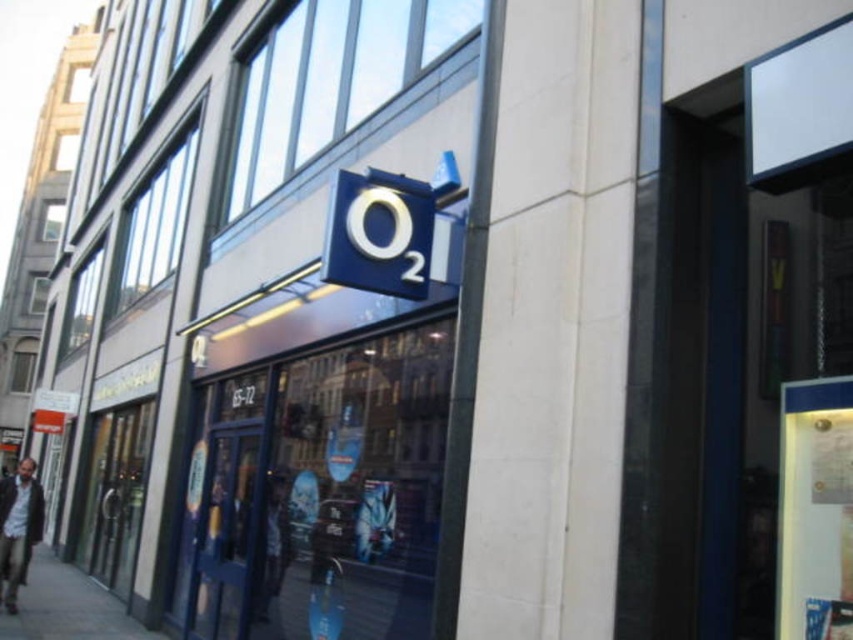
You are a delivery person trying to place a large package on the sidewalk near the O2 store entrance. The package is 1.2 meters wide. Can you safely place it on the concrete sidewalk at lower left without blocking the dark brown leather jacket at lower left?

The concrete sidewalk at lower left might be wider than dark brown leather jacket at lower left, so there is a possibility that the sidewalk is wide enough to accommodate the 1.2 meter wide package without blocking the jacket. However, the exact width isn

You are standing in front of the O2 store and want to take a photo of both the entrance doors and the O2 logo. You notice two points marked on your camera screen at coordinates point (80, 612) and point (282, 573). Which point is closer to you and should you focus on first to ensure both are in clear view?

Point (80, 612) is closer to you than point (282, 573), so you should focus on point (80, 612) first to ensure both points are in clear view.